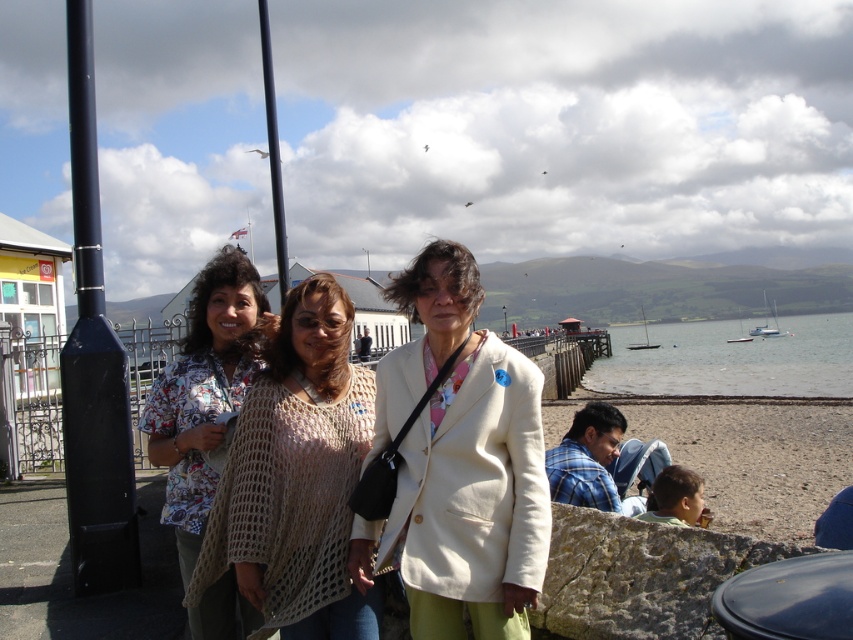
You are a photographer taking a picture of the three women on the seaside promenade. You want to focus on the crochet beige shawl at center and the black matte pole at left. Which object should you adjust your camera focus on first to ensure both are in sharp view?

The crochet beige shawl at center is closer to the viewer than the black matte pole at left. To ensure both are in sharp focus, adjust the camera focus starting with the crochet beige shawl at center since it is nearer, then adjust for the black matte pole at left further away.

You are a photographer trying to capture the entire scene of the three women and the background. You notice the black matte pole at left and the clear water at lower right. Which object is shorter in height?

The black matte pole at left is shorter than the clear water at lower right.